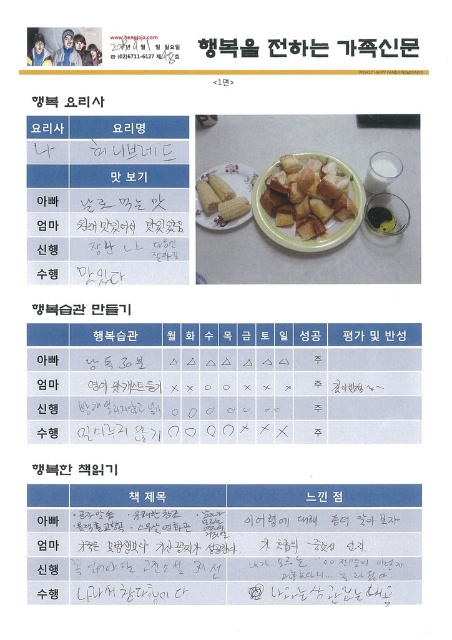
Can you confirm if golden brown croutons at center is positioned above yellow matte corn at center?

No.

Is golden brown croutons at center shorter than yellow matte corn at center?

In fact, golden brown croutons at center may be taller than yellow matte corn at center.

Does point (277, 205) come in front of point (238, 170)?

Yes, it is in front of point (238, 170).

Where is `golden brown croutons at center`? This screenshot has width=452, height=640. golden brown croutons at center is located at coordinates (310, 195).